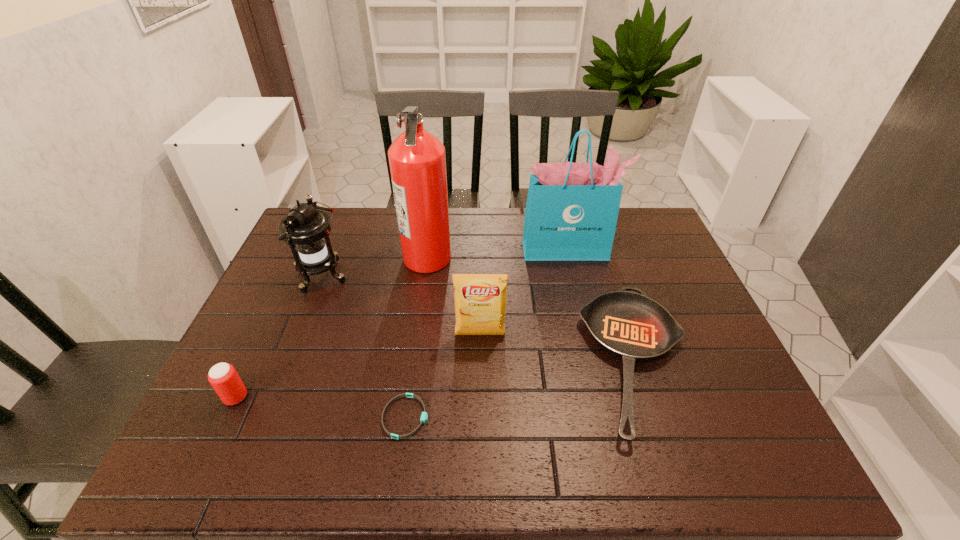
Identify the location of free spot between the tallest object and the third object from right to left. point(454,296).

The height and width of the screenshot is (540, 960). Find the location of `free space between the third object from right to left and the frying pan`. free space between the third object from right to left and the frying pan is located at coordinates (559, 348).

Identify the location of free spot between the third shortest object and the crisp (potato chip). (358, 366).

I want to click on vacant region between the crisp (potato chip) and the wristband, so click(443, 376).

Find the location of a particular element. This screenshot has height=540, width=960. free space between the shopping bag and the tallest object is located at coordinates (497, 253).

At what (x,y) coordinates should I click in order to perform the action: click on vacant area between the lantern and the beer can. Please return your answer as a coordinate pair (x, y). Looking at the image, I should click on (278, 337).

The width and height of the screenshot is (960, 540). Find the location of `vacant region between the shopping bag and the tallest object`. vacant region between the shopping bag and the tallest object is located at coordinates (497, 253).

Locate an element on the screen. The height and width of the screenshot is (540, 960). object that is the sixth closest to the fourth shortest object is located at coordinates (223, 377).

Locate an element on the screen. This screenshot has width=960, height=540. object that is the sixth closest to the fourth tallest object is located at coordinates (223, 377).

Identify the location of free space in the image that satisfies the following two spatial constraints: 1. on the front of the fourth shortest object with the logo; 2. on the right side of the sixth tallest object. (480, 360).